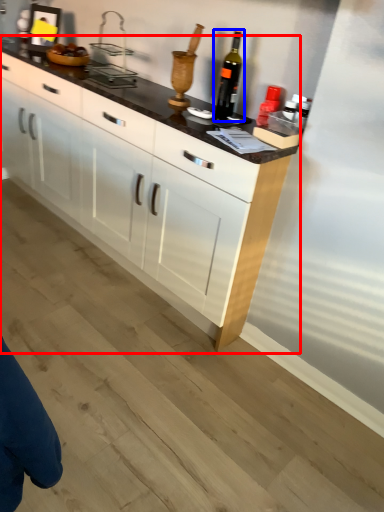
Question: Which of the following is the farthest to the observer, cabinetry (highlighted by a red box) or wine bottle (highlighted by a blue box)?

Choices:
 (A) cabinetry
 (B) wine bottle

Answer: (B)